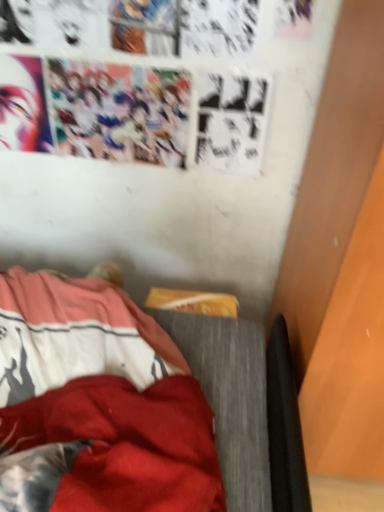
Question: From the image's perspective, is wooden bed frame at lower left located beneath smooth matte face at upper left?

Choices:
 (A) no
 (B) yes

Answer: (B)

Question: Does wooden bed frame at lower left appear on the right side of smooth matte face at upper left?

Choices:
 (A) no
 (B) yes

Answer: (B)

Question: Considering the relative sizes of wooden bed frame at lower left and smooth matte face at upper left in the image provided, is wooden bed frame at lower left thinner than smooth matte face at upper left?

Choices:
 (A) yes
 (B) no

Answer: (B)

Question: Could you tell me if wooden bed frame at lower left is facing smooth matte face at upper left?

Choices:
 (A) yes
 (B) no

Answer: (B)

Question: From the image's perspective, does wooden bed frame at lower left appear higher than smooth matte face at upper left?

Choices:
 (A) yes
 (B) no

Answer: (B)

Question: Is wooden bed frame at lower left closer to camera compared to smooth matte face at upper left?

Choices:
 (A) yes
 (B) no

Answer: (A)

Question: Is smooth matte face at upper left positioned behind wooden bed frame at lower left?

Choices:
 (A) yes
 (B) no

Answer: (A)

Question: Is smooth matte face at upper left smaller than wooden bed frame at lower left?

Choices:
 (A) no
 (B) yes

Answer: (B)

Question: From a real-world perspective, does smooth matte face at upper left stand above wooden bed frame at lower left?

Choices:
 (A) no
 (B) yes

Answer: (B)

Question: From the image's perspective, is smooth matte face at upper left on top of wooden bed frame at lower left?

Choices:
 (A) no
 (B) yes

Answer: (B)

Question: Is smooth matte face at upper left not inside wooden bed frame at lower left?

Choices:
 (A) yes
 (B) no

Answer: (A)

Question: Is smooth matte face at upper left thinner than wooden bed frame at lower left?

Choices:
 (A) no
 (B) yes

Answer: (B)

Question: Which is correct: smooth matte face at upper left is inside wooden bed frame at lower left, or outside of it?

Choices:
 (A) inside
 (B) outside

Answer: (B)